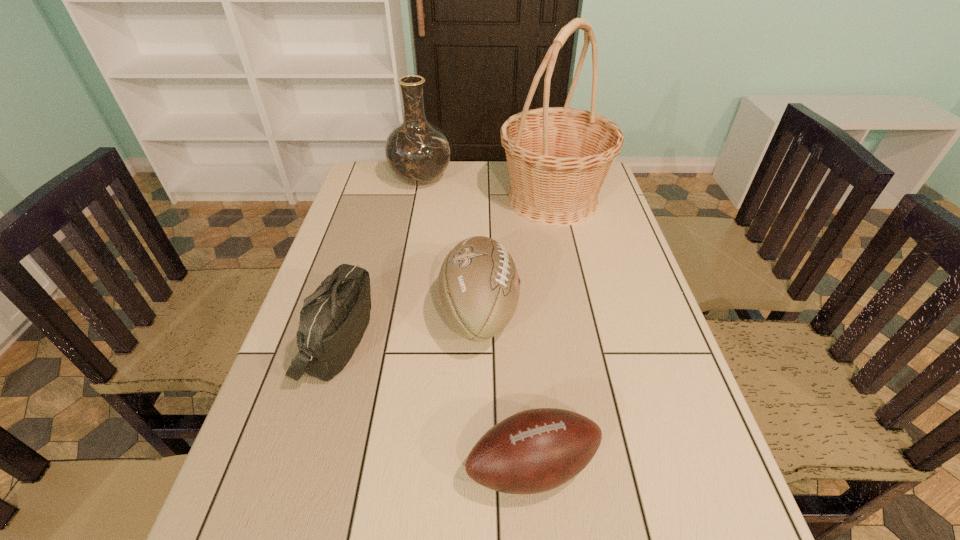
Locate an element on the screen. The width and height of the screenshot is (960, 540). basket is located at coordinates (558, 157).

Locate an element on the screen. The width and height of the screenshot is (960, 540). vase is located at coordinates (417, 151).

Identify the location of shoulder bag. The image size is (960, 540). (333, 320).

This screenshot has width=960, height=540. Identify the location of the farther football (American). (478, 286).

The height and width of the screenshot is (540, 960). Identify the location of the shortest object. (537, 450).

The height and width of the screenshot is (540, 960). Find the location of `the nearer football (American)`. the nearer football (American) is located at coordinates (537, 450).

Find the location of a particular element. blank space located on the left of the tallest object is located at coordinates (466, 200).

Find the location of a particular element. The image size is (960, 540). free space located on the front of the fourth shortest object is located at coordinates (408, 249).

Locate an element on the screen. This screenshot has height=540, width=960. vacant space located at the front padded panel of the shoulder bag is located at coordinates [411, 341].

You are a GUI agent. You are given a task and a screenshot of the screen. Output one action in this format:
    pyautogui.click(x=<x>, y=<y>)
    Task: Click on the vacant area situated 0.230m on the laces of the taller football (American)
    This screenshot has height=540, width=960.
    Given the screenshot: What is the action you would take?
    pyautogui.click(x=611, y=313)